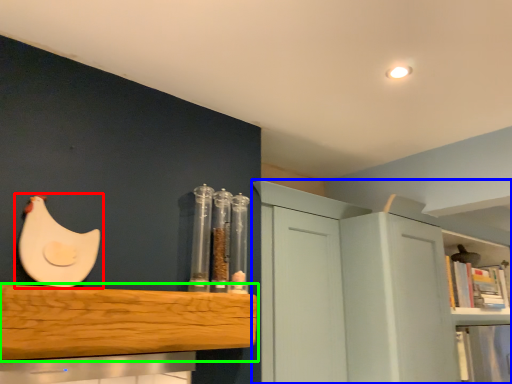
Question: Which object is the closest to the chicken (highlighted by a red box)? Choose among these: cabinetry (highlighted by a blue box) or shelf (highlighted by a green box).

Choices:
 (A) cabinetry
 (B) shelf

Answer: (B)